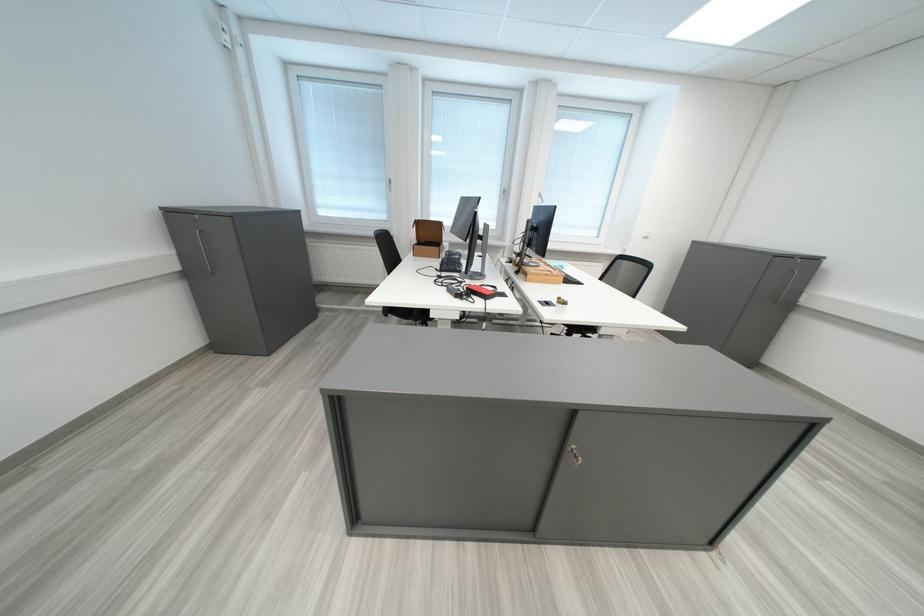
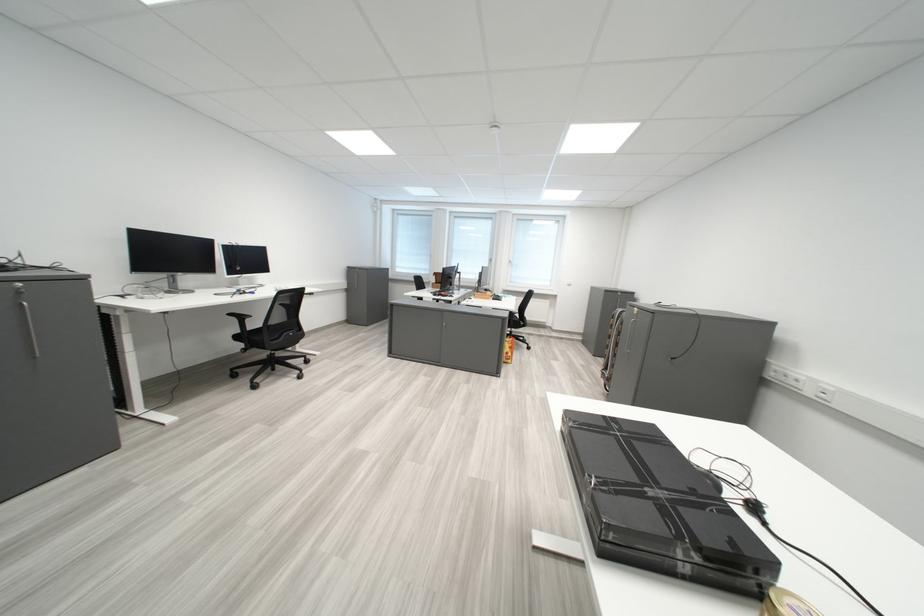
Question: I am providing you with two images of the same scene from different viewpoints. Which of the following objects are not visible in image2?

Choices:
 (A) black taped box
 (B) black chair armrest
 (C) heater dial
 (D) red power adapter

Answer: (D)